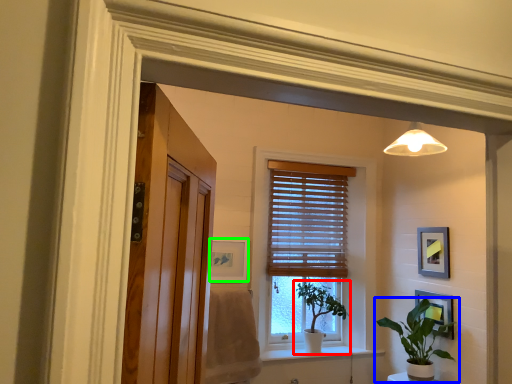
Question: Estimate the real-world distances between objects in this image. Which object is farther from houseplant (highlighted by a red box), houseplant (highlighted by a blue box) or picture frame (highlighted by a green box)?

Choices:
 (A) houseplant
 (B) picture frame

Answer: (B)